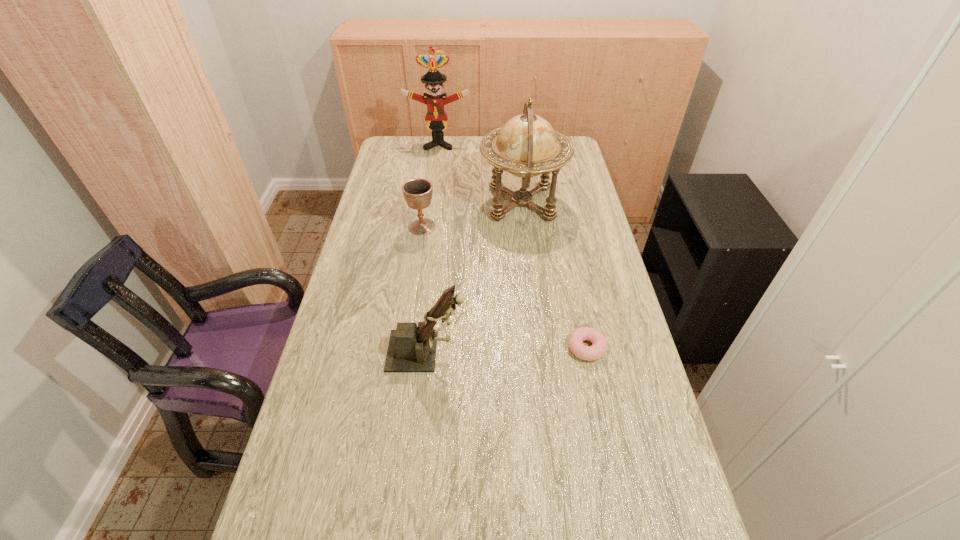
Locate an element on the screen. This screenshot has height=540, width=960. vacant area that lies between the globe and the chalice is located at coordinates (472, 215).

Identify the location of vacant space that is in between the shortest object and the third shortest object. (507, 349).

The image size is (960, 540). Find the location of `free spot between the fourth tallest object and the globe`. free spot between the fourth tallest object and the globe is located at coordinates (472, 215).

Locate an element on the screen. empty space that is in between the figurine and the nutcracker is located at coordinates (433, 248).

Image resolution: width=960 pixels, height=540 pixels. I want to click on free space between the figurine and the globe, so click(x=475, y=277).

Locate an element on the screen. free space that is in between the fourth tallest object and the globe is located at coordinates (472, 215).

Where is `vacant space in between the globe and the figurine`? This screenshot has height=540, width=960. vacant space in between the globe and the figurine is located at coordinates (475, 277).

Where is `free spot between the doughnut and the farthest object`? free spot between the doughnut and the farthest object is located at coordinates (513, 246).

Image resolution: width=960 pixels, height=540 pixels. What are the coordinates of `vacant area that lies between the globe and the doughnut` in the screenshot? It's located at (554, 275).

You are a GUI agent. You are given a task and a screenshot of the screen. Output one action in this format:
    pyautogui.click(x=<x>, y=<y>)
    Task: Click on the free space between the globe and the doughnut
    This screenshot has height=540, width=960.
    Given the screenshot: What is the action you would take?
    pyautogui.click(x=554, y=275)